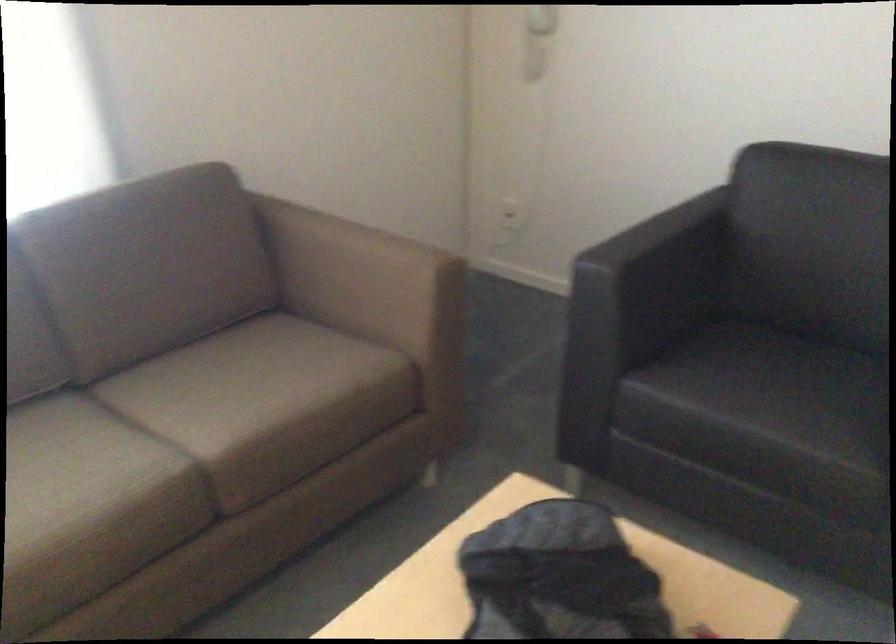
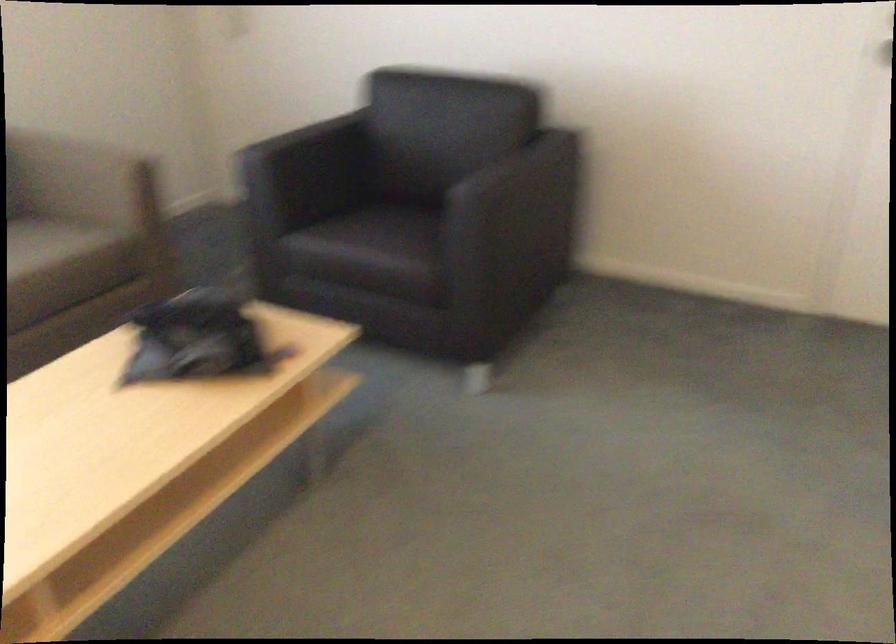
What movement of the cameraman would produce the second image?

The movement direction of the cameraman is right, backward.